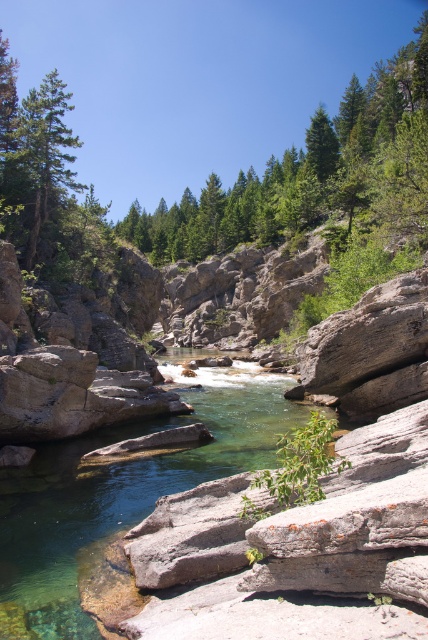
Which is in front, point (15, 593) or point (35, 145)?

Point (15, 593) is in front.

Is clear stone stream at center shorter than green matte tree at upper left?

Indeed, clear stone stream at center has a lesser height compared to green matte tree at upper left.

Locate an element on the screen. The height and width of the screenshot is (640, 428). clear stone stream at center is located at coordinates (121, 492).

Can you confirm if clear stone stream at center is taller than green matte tree at upper center?

In fact, clear stone stream at center may be shorter than green matte tree at upper center.

Describe the element at coordinates (121, 492) in the screenshot. I see `clear stone stream at center` at that location.

You are a GUI agent. You are given a task and a screenshot of the screen. Output one action in this format:
    pyautogui.click(x=<x>, y=<y>)
    Task: Click on the clear stone stream at center
    The width and height of the screenshot is (428, 640).
    Given the screenshot: What is the action you would take?
    pyautogui.click(x=121, y=492)

Looking at this image, can you confirm if green leafy tree at center is wider than green matte tree at upper center?

Yes, green leafy tree at center is wider than green matte tree at upper center.

Which is in front, point (160, 208) or point (308, 157)?

Point (308, 157) is more forward.

Where is `green leafy tree at center`? The width and height of the screenshot is (428, 640). green leafy tree at center is located at coordinates click(x=312, y=173).